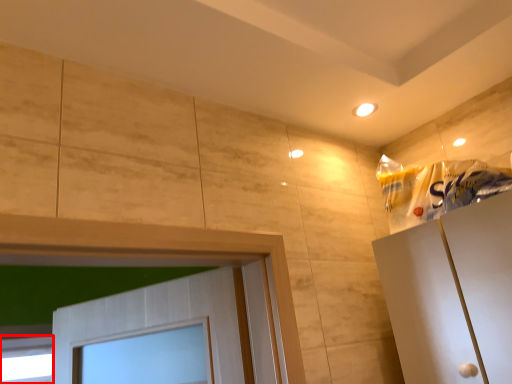
Question: From the image's perspective, what is the correct spatial positioning of window (annotated by the red box) in reference to material?

Choices:
 (A) above
 (B) below

Answer: (B)